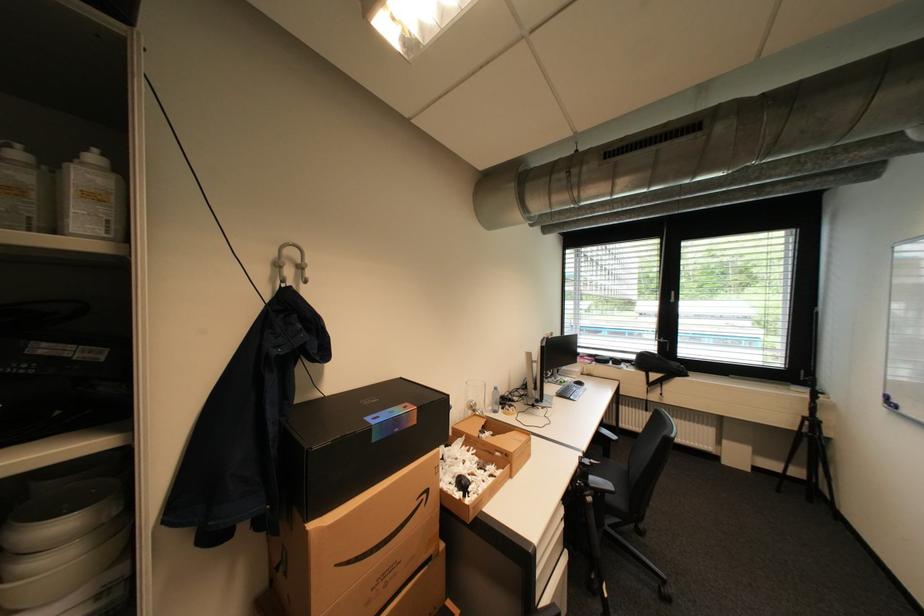
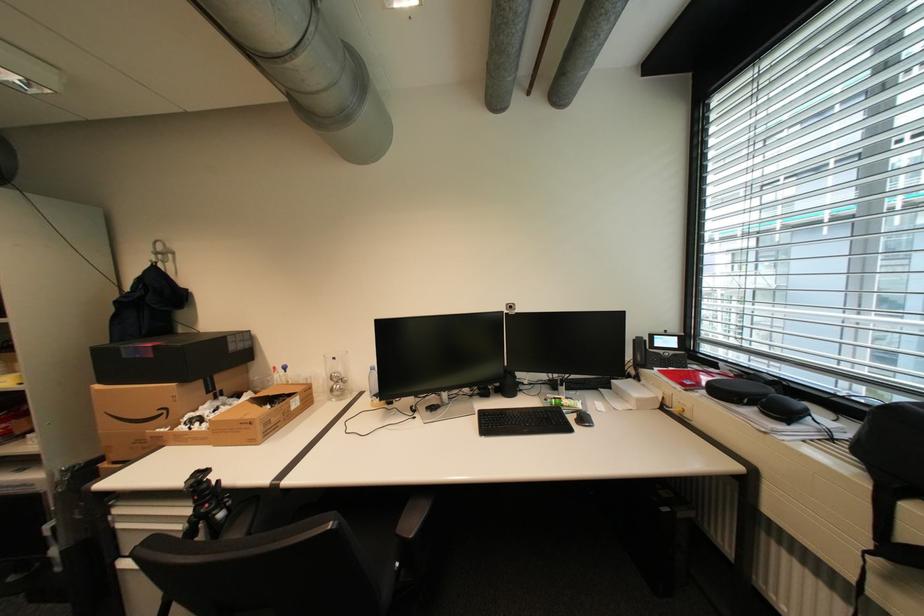
Where in the second image is the point corresponding to pixel 424 424 from the first image?

(161, 357)